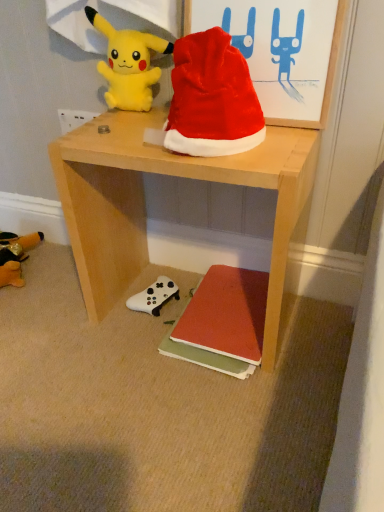
Where is `vacant space to the right of red velvet santa hat at upper center`? The width and height of the screenshot is (384, 512). vacant space to the right of red velvet santa hat at upper center is located at coordinates (286, 138).